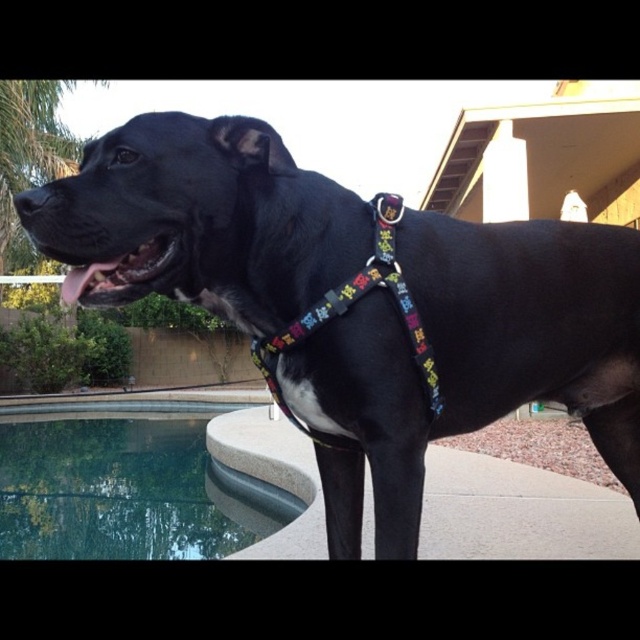
Question: Which object appears closest to the camera in this image?

Choices:
 (A) clear glass water at lower left
 (B) black matte harness at center

Answer: (B)

Question: Considering the relative positions of black matte harness at center and multicolored fabric harness at center in the image provided, where is black matte harness at center located with respect to multicolored fabric harness at center?

Choices:
 (A) below
 (B) above

Answer: (A)

Question: Which of the following is the farthest from the observer?

Choices:
 (A) (58, 410)
 (B) (388, 234)
 (C) (154, 236)

Answer: (A)

Question: Which of the following is the farthest from the observer?

Choices:
 (A) (324, 294)
 (B) (237, 212)
 (C) (132, 404)

Answer: (C)

Question: Does black matte harness at center have a larger size compared to clear glass water at lower left?

Choices:
 (A) yes
 (B) no

Answer: (B)

Question: Is clear glass water at lower left smaller than multicolored fabric harness at center?

Choices:
 (A) yes
 (B) no

Answer: (B)